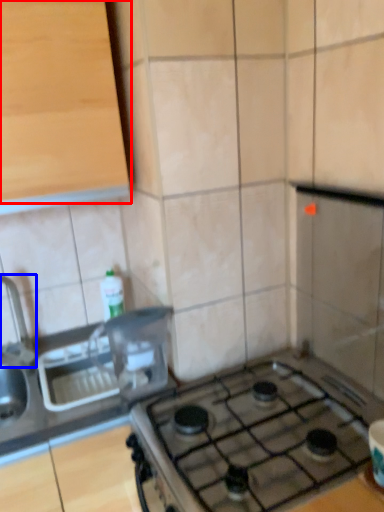
Question: Which point is further to the camera, cabinetry (highlighted by a red box) or faucet (highlighted by a blue box)?

Choices:
 (A) cabinetry
 (B) faucet

Answer: (B)